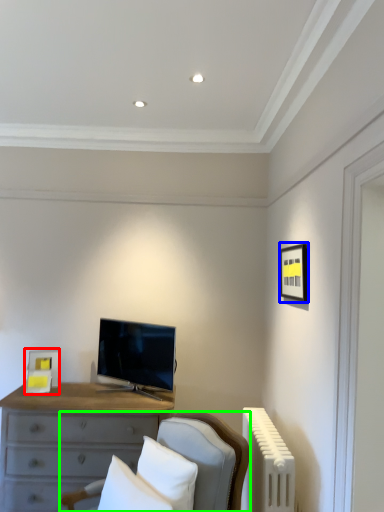
Question: Considering the real-world distances, which object is farthest from picture frame (highlighted by a red box)? picture frame (highlighted by a blue box) or furniture (highlighted by a green box)?

Choices:
 (A) picture frame
 (B) furniture

Answer: (A)